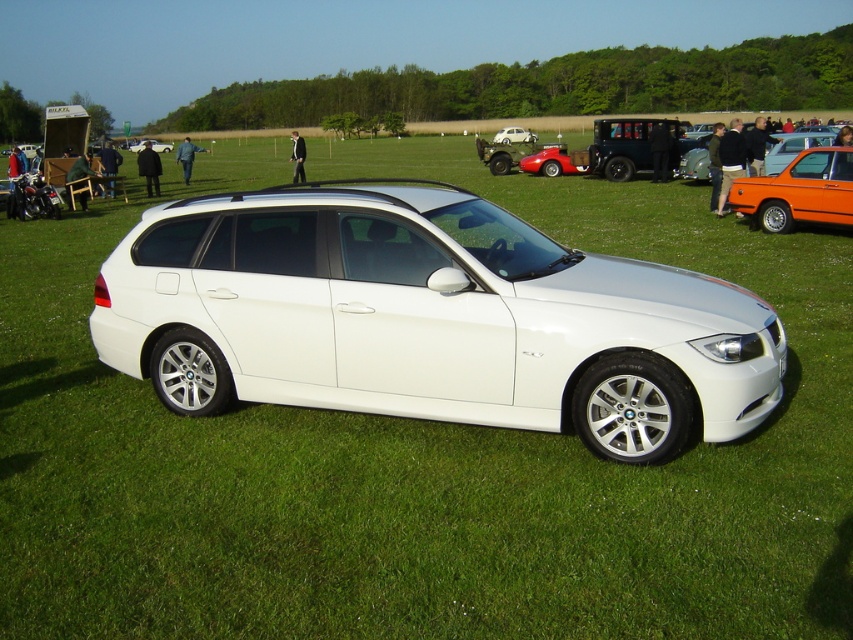
You are standing at the point with coordinates point (799, 192). You want to walk towards the orange metallic car at right. Which direction should you face?

You should face towards the right direction to walk towards the orange metallic car at right located at point (799, 192).

You are a photographer standing at the edge of the grassy field where the metallic silver car at center and the white matte hatchback at center are parked. You want to take a photo that includes both vehicles in the frame. Given that your camera has a maximum focal length that allows capturing objects up to 100 feet apart, will you be able to include both cars in a single shot?

The metallic silver car at center and white matte hatchback at center are 114.53 feet apart, which exceeds the camera maximum focal length of 100 feet. Therefore, you cannot include both cars in a single shot.

You are standing at the origin point of the coordinate system. You want to walk to the metallic silver car at center. Which direction should you move in?

The metallic silver car at center is located at point (514, 134), so you should move northeast to reach it.